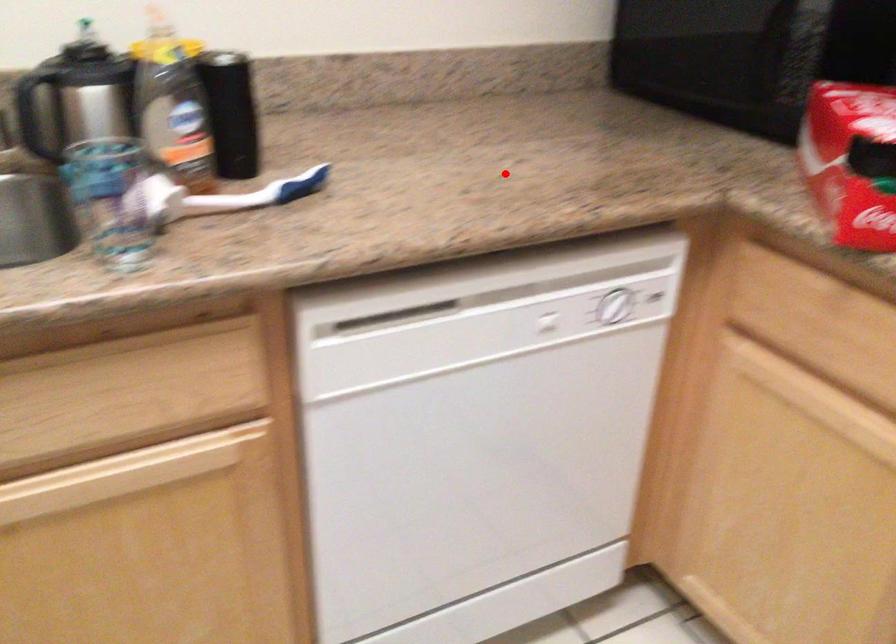
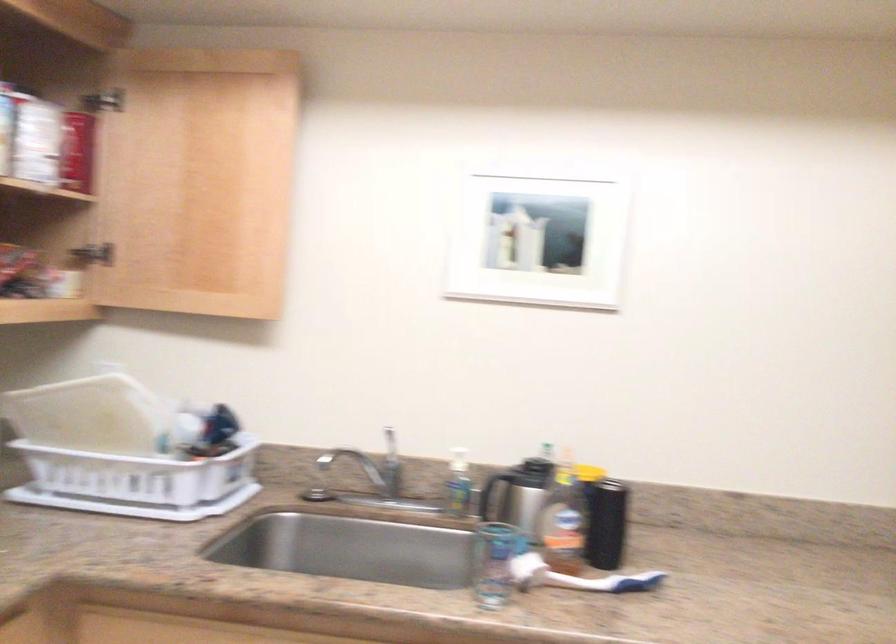
In the second image, find the point that corresponds to the highlighted location in the first image.

(828, 621)